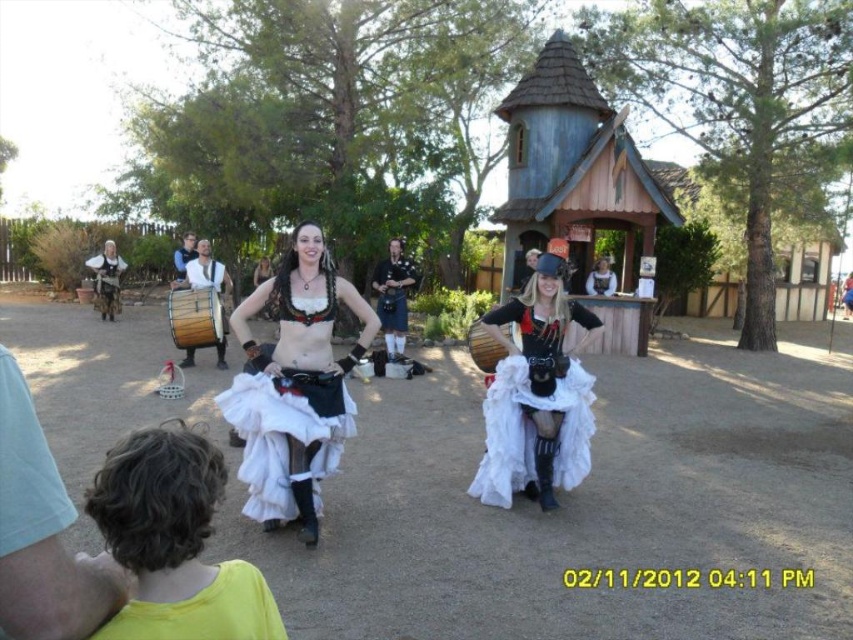
You are a photographer at the Renaissance fair. You want to take a photo of both the point at (506, 458) and the point at (107, 284). Which point should you focus on first to ensure both are in the frame?

You should focus on point (506, 458) first because it is in front of point (107, 284), ensuring both are visible in the frame.

You are standing at the Renaissance fair and see two points marked in the scene. Which point is closer to you, point (292, 456) or point (412, 275)?

Point (292, 456) is in front of point (412, 275), so it is closer to you.

Consider the image. You are a photographer at the Renaissance fair and want to capture a photo of the white tulle skirt at center and the matte black drum at center. Which object should you focus on first if you want to include both in the frame without moving the camera?

The white tulle skirt at center is below the matte black drum at center, so you should focus on the matte black drum at center first to ensure both are in the frame.